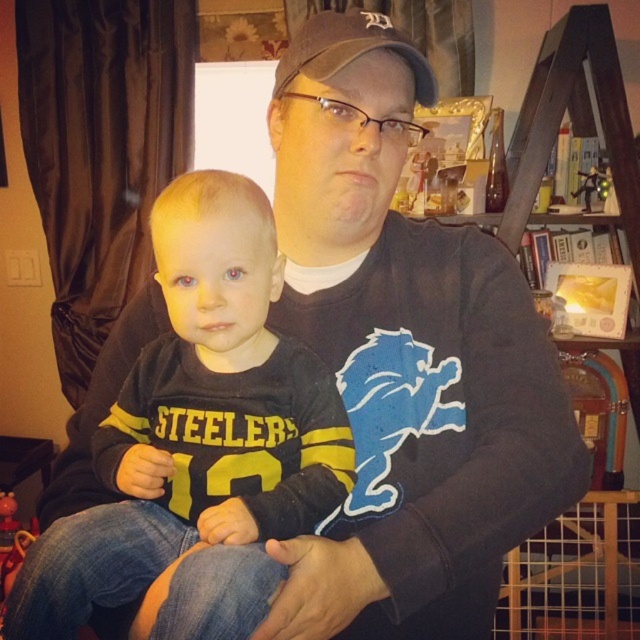
Question: Which point is farther from the camera taking this photo?

Choices:
 (A) (424, 97)
 (B) (262, 230)

Answer: (A)

Question: Is black jersey at center above brown fabric baseball cap at upper center?

Choices:
 (A) yes
 (B) no

Answer: (B)

Question: Is black jersey at center smaller than brown fabric baseball cap at upper center?

Choices:
 (A) no
 (B) yes

Answer: (A)

Question: Among these points, which one is farthest from the camera?

Choices:
 (A) (308, 61)
 (B) (188, 474)

Answer: (A)

Question: Which point is farther to the camera?

Choices:
 (A) (184, 337)
 (B) (298, 51)

Answer: (B)

Question: Is black jersey at center bigger than brown fabric baseball cap at upper center?

Choices:
 (A) yes
 (B) no

Answer: (A)